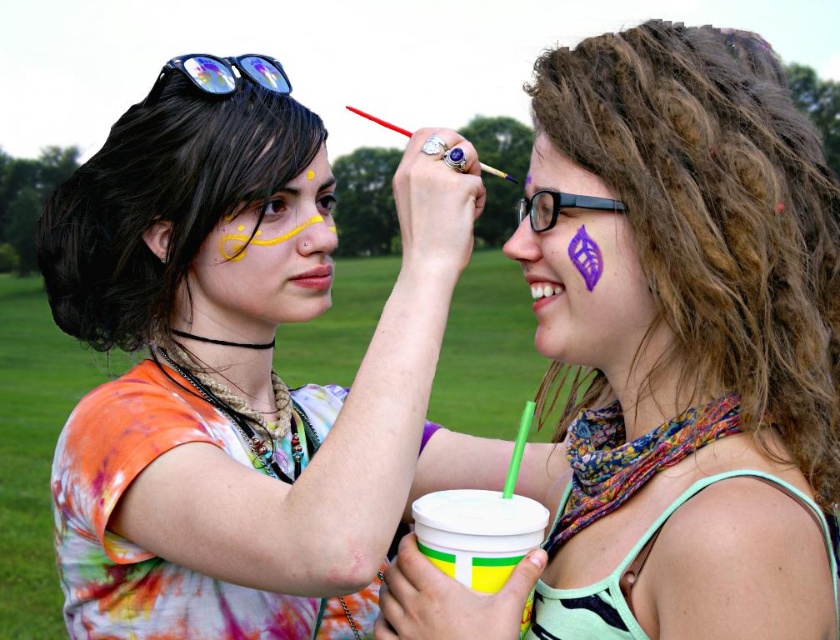
You are a photographer taking a picture of the two people in the scene. You notice the purple matte face paint at upper center and the shiny blue eye at center. Which object should you focus on first to ensure it appears sharp in the photo?

You should focus on the purple matte face paint at upper center first because it is closer to the viewer than the shiny blue eye at center, so focusing on the closer object ensures it will be sharp.

You are standing in the grassy field and want to find the yellow matte paint at upper center. According to the coordinates given, where should you look relative to the center of the image?

The yellow matte paint at upper center is located at coordinates point [313,172], which means it is positioned 27.0 percent to the left and 37.4 percent above the center of the image.